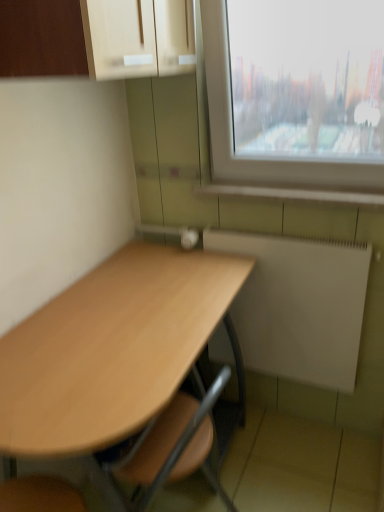
Question: Is white matte radiator at lower right shorter than white tile at lower right?

Choices:
 (A) no
 (B) yes

Answer: (A)

Question: Is white matte radiator at lower right to the right of white tile at lower right from the viewer's perspective?

Choices:
 (A) yes
 (B) no

Answer: (A)

Question: Is white matte radiator at lower right facing away from white tile at lower right?

Choices:
 (A) no
 (B) yes

Answer: (A)

Question: From the image's perspective, is white matte radiator at lower right over white tile at lower right?

Choices:
 (A) yes
 (B) no

Answer: (B)

Question: Is there a large distance between white matte radiator at lower right and white tile at lower right?

Choices:
 (A) no
 (B) yes

Answer: (A)

Question: Choose the correct answer: Is light brown wood desk at center inside white tile at lower right or outside it?

Choices:
 (A) outside
 (B) inside

Answer: (A)

Question: Based on their sizes in the image, would you say light brown wood desk at center is bigger or smaller than white tile at lower right?

Choices:
 (A) small
 (B) big

Answer: (B)

Question: In terms of width, does light brown wood desk at center look wider or thinner when compared to white tile at lower right?

Choices:
 (A) wide
 (B) thin

Answer: (A)

Question: Is light brown wood desk at center taller or shorter than white tile at lower right?

Choices:
 (A) tall
 (B) short

Answer: (A)

Question: In terms of size, does white tile at lower right appear bigger or smaller than white matte radiator at lower right?

Choices:
 (A) small
 (B) big

Answer: (A)

Question: From a real-world perspective, relative to white matte radiator at lower right, is white tile at lower right vertically above or below?

Choices:
 (A) below
 (B) above

Answer: (B)

Question: In the image, is white tile at lower right on the left side or the right side of white matte radiator at lower right?

Choices:
 (A) right
 (B) left

Answer: (B)

Question: Is white tile at lower right taller or shorter than white matte radiator at lower right?

Choices:
 (A) tall
 (B) short

Answer: (B)

Question: From their relative heights in the image, would you say light brown wood desk at center is taller or shorter than white matte radiator at lower right?

Choices:
 (A) short
 (B) tall

Answer: (B)

Question: Is point (122, 401) positioned closer to the camera than point (208, 247)?

Choices:
 (A) closer
 (B) farther

Answer: (A)